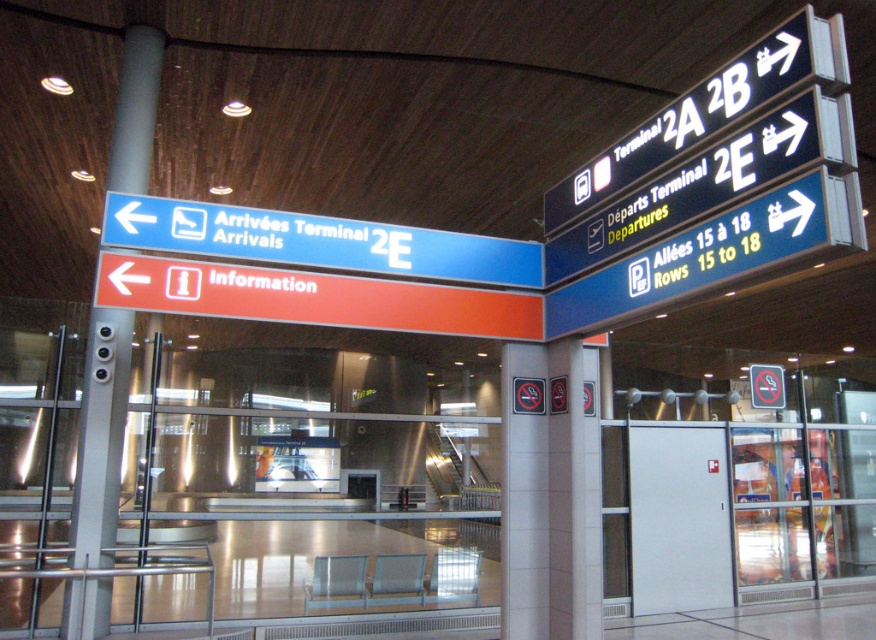
Question: Considering the real-world distances, which object is closest to the black plastic sign at upper right?

Choices:
 (A) blue plastic sign at left
 (B) gray metallic pole at left

Answer: (A)

Question: Which is farther from the black plastic sign at upper right?

Choices:
 (A) gray metallic pole at left
 (B) blue plastic sign at left

Answer: (A)

Question: Is blue plastic sign at left below gray metallic pole at left?

Choices:
 (A) yes
 (B) no

Answer: (B)

Question: Which of the following is the closest to the observer?

Choices:
 (A) (620, 147)
 (B) (100, 456)
 (C) (429, 237)

Answer: (A)

Question: Does blue plastic sign at left lie behind gray metallic pole at left?

Choices:
 (A) yes
 (B) no

Answer: (B)

Question: Is blue plastic sign at left positioned in front of gray metallic pole at left?

Choices:
 (A) yes
 (B) no

Answer: (A)